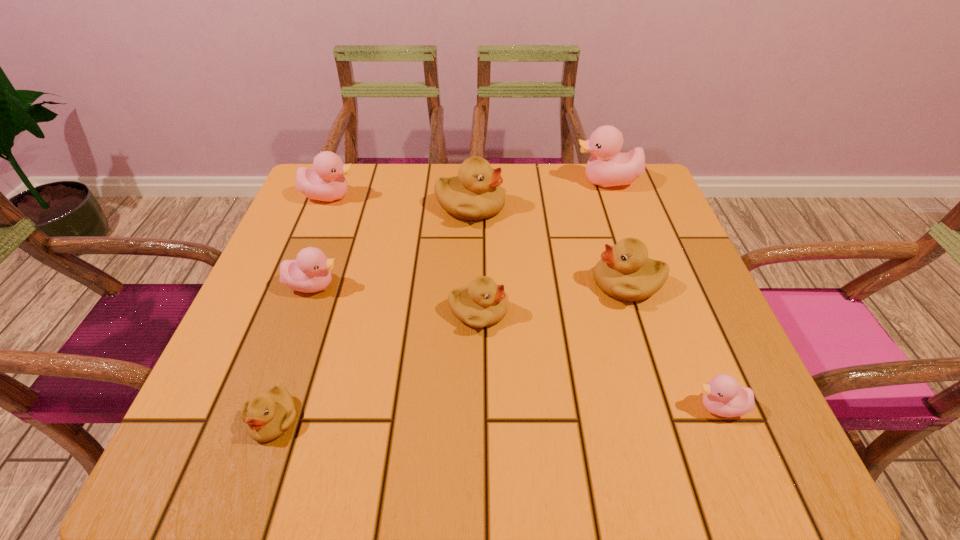
Identify the location of empty location between the nearest pink duckling and the third biggest yellow duckling. This screenshot has height=540, width=960. (598, 360).

At what (x,y) coordinates should I click in order to perform the action: click on unoccupied position between the second biggest yellow duckling and the second biggest pink duckling. Please return your answer as a coordinate pair (x, y). The height and width of the screenshot is (540, 960). Looking at the image, I should click on pyautogui.click(x=478, y=240).

Locate an element on the screen. This screenshot has height=540, width=960. unoccupied area between the smallest pink duckling and the smallest yellow duckling is located at coordinates (496, 413).

Identify the location of free spot between the biggest pink duckling and the farthest yellow duckling. The width and height of the screenshot is (960, 540). (539, 194).

Where is `free space between the farthest yellow duckling and the third smallest pink duckling`? The image size is (960, 540). free space between the farthest yellow duckling and the third smallest pink duckling is located at coordinates (400, 201).

The image size is (960, 540). I want to click on vacant region between the rightmost yellow duckling and the smallest pink duckling, so click(x=673, y=345).

Locate an element on the screen. free space that is in between the rightmost yellow duckling and the nearest pink duckling is located at coordinates (673, 345).

Identify the location of vacant space that is in between the second biggest pink duckling and the smallest pink duckling. (524, 302).

Locate an element on the screen. This screenshot has height=540, width=960. vacant area that lies between the second biggest pink duckling and the farthest yellow duckling is located at coordinates (400, 201).

Choose which object is the seventh nearest neighbor to the smallest pink duckling. Please provide its 2D coordinates. Your answer should be formatted as a tuple, i.e. [(x, y)], where the tuple contains the x and y coordinates of a point satisfying the conditions above.

[(326, 182)]